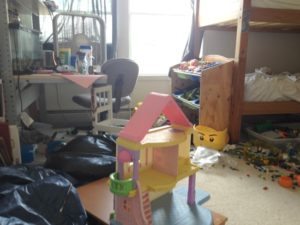
Identify the location of stairs. (143, 206).